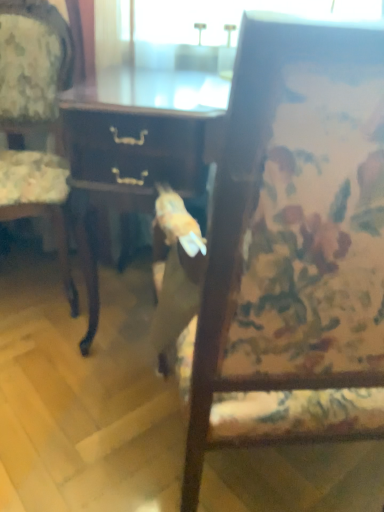
Where is `wooden desk at center`? The width and height of the screenshot is (384, 512). wooden desk at center is located at coordinates (142, 133).

The width and height of the screenshot is (384, 512). In order to click on wooden floral-patterned chair at left, which appears as the 1th chair when viewed from the left in this screenshot , I will do `click(32, 64)`.

What are the coordinates of `wooden chair at center, which is the 2th chair in left-to-right order` in the screenshot? It's located at (294, 245).

Looking at this image, measure the distance between point (298,244) and camera.

They are 18.35 inches apart.

The image size is (384, 512). Find the location of `wooden desk at center`. wooden desk at center is located at coordinates click(x=142, y=133).

From the picture: Which is behind, wooden desk at center or wooden chair at center, which is the 2th chair in left-to-right order?

wooden desk at center is further away from the camera.

Is wooden desk at center oriented towards wooden chair at center, arranged as the first chair when viewed from the right?

Yes, wooden desk at center is turned towards wooden chair at center, arranged as the first chair when viewed from the right.

I want to click on chair that appears in front of the wooden desk at center, so click(294, 245).

Can you confirm if wooden desk at center is thinner than wooden chair at center, arranged as the first chair when viewed from the right?

Correct, the width of wooden desk at center is less than that of wooden chair at center, arranged as the first chair when viewed from the right.

Where is `chair that appears below the wooden floral-patterned chair at left, placed as the second chair when sorted from right to left (from the image's perspective)`? This screenshot has height=512, width=384. chair that appears below the wooden floral-patterned chair at left, placed as the second chair when sorted from right to left (from the image's perspective) is located at coordinates (294, 245).

From a real-world perspective, which object rests below the other?

wooden floral-patterned chair at left, which appears as the 1th chair when viewed from the left, from a real-world perspective.

Which of these two, wooden chair at center, arranged as the first chair when viewed from the right, or wooden floral-patterned chair at left, which appears as the 1th chair when viewed from the left, stands taller?

wooden chair at center, arranged as the first chair when viewed from the right.

Is wooden floral-patterned chair at left, placed as the second chair when sorted from right to left, inside or outside of wooden desk at center?

wooden floral-patterned chair at left, placed as the second chair when sorted from right to left, cannot be found inside wooden desk at center.

Is wooden floral-patterned chair at left, which appears as the 1th chair when viewed from the left, oriented away from wooden desk at center?

No, wooden floral-patterned chair at left, which appears as the 1th chair when viewed from the left,'s orientation is not away from wooden desk at center.

Is wooden floral-patterned chair at left, which appears as the 1th chair when viewed from the left, positioned behind wooden chair at center, which is the 2th chair in left-to-right order?

Yes.

Where is `chair that is on the right side of wooden floral-patterned chair at left, which appears as the 1th chair when viewed from the left`? This screenshot has width=384, height=512. chair that is on the right side of wooden floral-patterned chair at left, which appears as the 1th chair when viewed from the left is located at coordinates (294, 245).

Considering the sizes of objects wooden floral-patterned chair at left, which appears as the 1th chair when viewed from the left, and wooden chair at center, arranged as the first chair when viewed from the right, in the image provided, who is shorter, wooden floral-patterned chair at left, which appears as the 1th chair when viewed from the left, or wooden chair at center, arranged as the first chair when viewed from the right,?

With less height is wooden floral-patterned chair at left, which appears as the 1th chair when viewed from the left.

Is wooden chair at center, which is the 2th chair in left-to-right order, completely or partially inside wooden floral-patterned chair at left, which appears as the 1th chair when viewed from the left?

No.

From a real-world perspective, is wooden chair at center, arranged as the first chair when viewed from the right, positioned over wooden desk at center based on gravity?

Correct, in the physical world, wooden chair at center, arranged as the first chair when viewed from the right, is higher than wooden desk at center.

Between wooden chair at center, which is the 2th chair in left-to-right order, and wooden desk at center, which one appears on the left side from the viewer's perspective?

wooden desk at center is more to the left.

Considering the points (155, 127) and (54, 224), which point is in front, point (155, 127) or point (54, 224)?

The point (155, 127) is closer.

Is wooden desk at center positioned with its back to wooden floral-patterned chair at left, which appears as the 1th chair when viewed from the left?

wooden desk at center is not turned away from wooden floral-patterned chair at left, which appears as the 1th chair when viewed from the left.

From the picture: Is wooden desk at center located outside wooden floral-patterned chair at left, placed as the second chair when sorted from right to left?

wooden desk at center lies outside wooden floral-patterned chair at left, placed as the second chair when sorted from right to left,'s area.

Which is in front, wooden desk at center or wooden floral-patterned chair at left, which appears as the 1th chair when viewed from the left?

Positioned in front is wooden desk at center.

You are a GUI agent. You are given a task and a screenshot of the screen. Output one action in this format:
    pyautogui.click(x=<x>, y=<y>)
    Task: Click on the chair on the right side of wooden desk at center
    This screenshot has width=384, height=512.
    Given the screenshot: What is the action you would take?
    pyautogui.click(x=294, y=245)

Where is `chair above the wooden chair at center, which is the 2th chair in left-to-right order (from the image's perspective)`? The width and height of the screenshot is (384, 512). chair above the wooden chair at center, which is the 2th chair in left-to-right order (from the image's perspective) is located at coordinates (32, 64).

Looking at the image, which one is located further to wooden chair at center, arranged as the first chair when viewed from the right, wooden desk at center or wooden floral-patterned chair at left, which appears as the 1th chair when viewed from the left?

Among the two, wooden floral-patterned chair at left, which appears as the 1th chair when viewed from the left, is located further to wooden chair at center, arranged as the first chair when viewed from the right.

When comparing their distances from wooden floral-patterned chair at left, placed as the second chair when sorted from right to left, does wooden desk at center or wooden chair at center, which is the 2th chair in left-to-right order, seem closer?

wooden desk at center.

From the image, which object appears to be farther from wooden chair at center, which is the 2th chair in left-to-right order, wooden floral-patterned chair at left, placed as the second chair when sorted from right to left, or wooden desk at center?

wooden floral-patterned chair at left, placed as the second chair when sorted from right to left, is positioned further to the anchor wooden chair at center, which is the 2th chair in left-to-right order.

Based on their spatial positions, is wooden chair at center, which is the 2th chair in left-to-right order, or wooden floral-patterned chair at left, placed as the second chair when sorted from right to left, further from wooden desk at center?

wooden chair at center, which is the 2th chair in left-to-right order, is further to wooden desk at center.

From the image, which object appears to be nearer to wooden floral-patterned chair at left, placed as the second chair when sorted from right to left, wooden chair at center, arranged as the first chair when viewed from the right, or wooden desk at center?

wooden desk at center is positioned closer to the anchor wooden floral-patterned chair at left, placed as the second chair when sorted from right to left.

From the image, which object appears to be nearer to wooden desk at center, wooden floral-patterned chair at left, which appears as the 1th chair when viewed from the left, or wooden chair at center, which is the 2th chair in left-to-right order?

wooden floral-patterned chair at left, which appears as the 1th chair when viewed from the left, lies closer to wooden desk at center than the other object.

Identify the location of desk located between wooden chair at center, arranged as the first chair when viewed from the right, and wooden floral-patterned chair at left, placed as the second chair when sorted from right to left, in the depth direction. This screenshot has width=384, height=512. (142, 133).